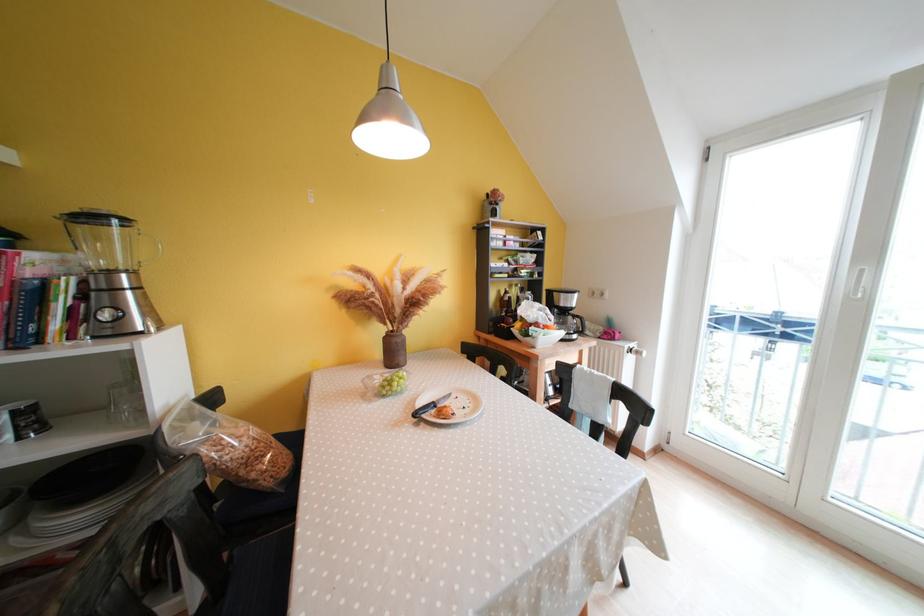
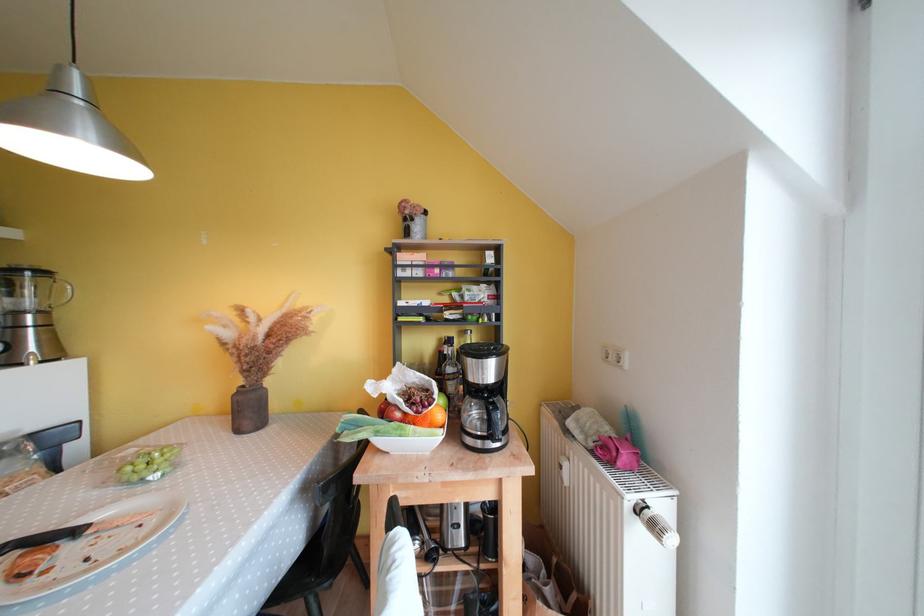
The point at (x=140, y=276) is marked in the first image. Where is the corresponding point in the second image?

(49, 315)